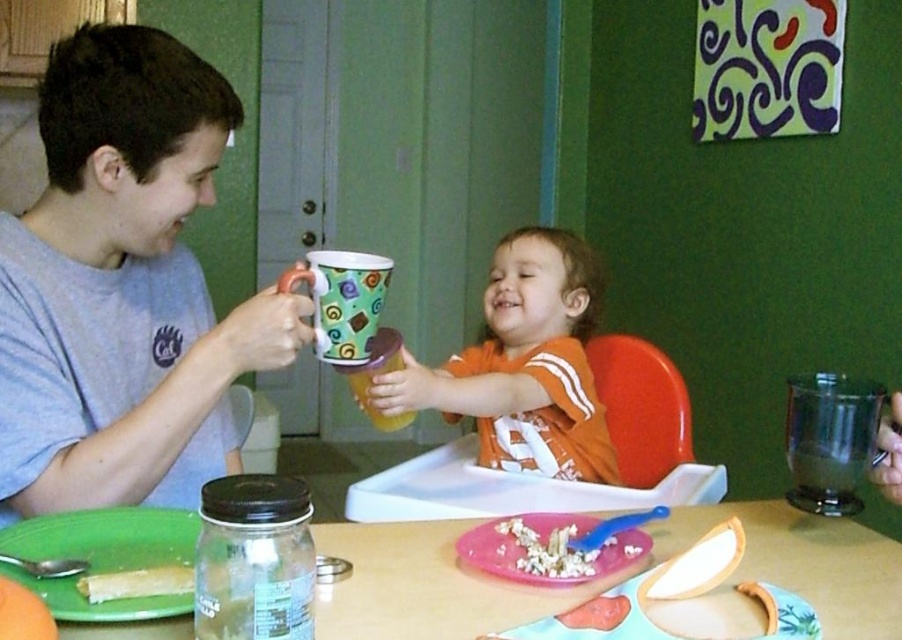
You are a parent trying to clean up after a meal. You see the orange cotton shirt at center and the crumbly white popcorn at center on the table. Which item should you pick up first to avoid the popcorn rolling away?

You should pick up the crumbly white popcorn at center first because it is loose and might roll away, while the orange cotton shirt at center is a solid item that won not move easily.

You are standing at the entrance of the room and want to place a new plant pot on the floor near the orange plastic chair at center. According to the coordinates provided, where should you place the plant pot?

The orange plastic chair at center is located at point (641, 406), so you should place the plant pot near those coordinates to position it close to the orange plastic chair at center.